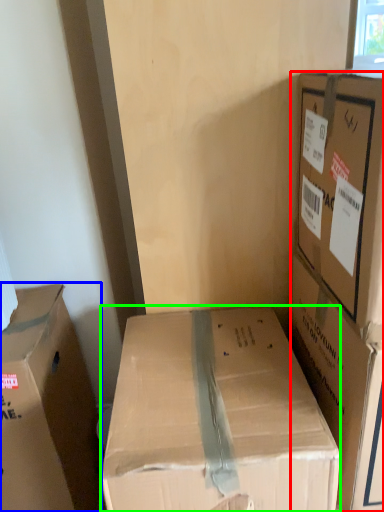
Question: Considering the real-world distances, which object is closest to box (highlighted by a red box)? box (highlighted by a blue box) or box (highlighted by a green box).

Choices:
 (A) box
 (B) box

Answer: (B)